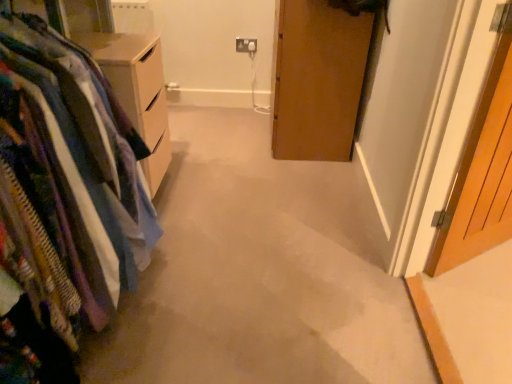
Question: Is wooden door at right bigger than white plastic electric outlet at upper center?

Choices:
 (A) yes
 (B) no

Answer: (A)

Question: Can you confirm if wooden door at right is positioned to the left of white plastic electric outlet at upper center?

Choices:
 (A) no
 (B) yes

Answer: (A)

Question: Is wooden door at right facing away from white plastic electric outlet at upper center?

Choices:
 (A) yes
 (B) no

Answer: (A)

Question: Can you confirm if wooden door at right is taller than white plastic electric outlet at upper center?

Choices:
 (A) yes
 (B) no

Answer: (A)

Question: Is wooden door at right thinner than white plastic electric outlet at upper center?

Choices:
 (A) yes
 (B) no

Answer: (B)

Question: From their relative heights in the image, would you say white plastic electric outlet at upper center is taller or shorter than textured fabric closet at left?

Choices:
 (A) tall
 (B) short

Answer: (B)

Question: In the image, is white plastic electric outlet at upper center on the left side or the right side of textured fabric closet at left?

Choices:
 (A) left
 (B) right

Answer: (B)

Question: Is white plastic electric outlet at upper center situated inside textured fabric closet at left or outside?

Choices:
 (A) outside
 (B) inside

Answer: (A)

Question: In terms of width, does white plastic electric outlet at upper center look wider or thinner when compared to textured fabric closet at left?

Choices:
 (A) thin
 (B) wide

Answer: (A)

Question: Considering the positions of point (x=256, y=46) and point (x=479, y=208), is point (x=256, y=46) closer or farther from the camera than point (x=479, y=208)?

Choices:
 (A) closer
 (B) farther

Answer: (B)

Question: Visually, is white plastic electric outlet at upper center positioned to the left or to the right of wooden door at right?

Choices:
 (A) right
 (B) left

Answer: (B)

Question: Is white plastic electric outlet at upper center spatially inside wooden door at right, or outside of it?

Choices:
 (A) inside
 (B) outside

Answer: (B)

Question: Is white plastic electric outlet at upper center bigger or smaller than wooden door at right?

Choices:
 (A) small
 (B) big

Answer: (A)

Question: Considering the positions of wooden door at right and textured fabric closet at left in the image, is wooden door at right wider or thinner than textured fabric closet at left?

Choices:
 (A) thin
 (B) wide

Answer: (A)

Question: Which is correct: wooden door at right is inside textured fabric closet at left, or outside of it?

Choices:
 (A) outside
 (B) inside

Answer: (A)